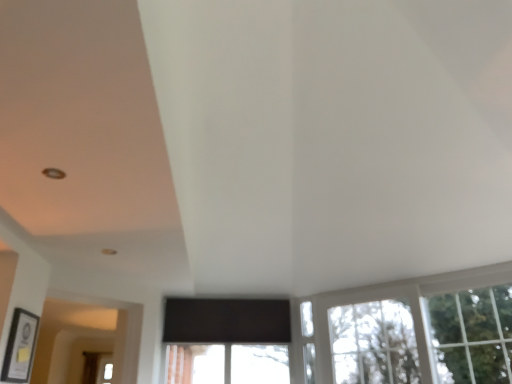
Question: From the image's perspective, is green leafy tree at upper right located above or below clear glass window at lower right?

Choices:
 (A) below
 (B) above

Answer: (B)

Question: In the image, is green leafy tree at upper right positioned in front of or behind clear glass window at lower right?

Choices:
 (A) front
 (B) behind

Answer: (A)

Question: Estimate the real-world distances between objects in this image. Which object is farther from the matte black picture frame at lower left?

Choices:
 (A) green leafy tree at upper right
 (B) clear glass window at lower right

Answer: (A)

Question: Estimate the real-world distances between objects in this image. Which object is farther from the green leafy tree at upper right?

Choices:
 (A) clear glass window at lower right
 (B) matte black picture frame at lower left

Answer: (B)